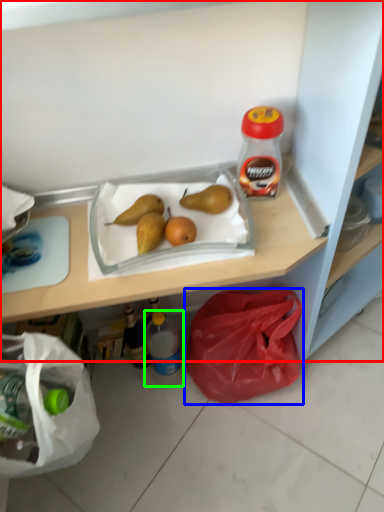
Question: Based on their relative distances, which object is nearer to shelf (highlighted by a red box)? Choose from plastic bag (highlighted by a blue box) and bottle (highlighted by a green box).

Choices:
 (A) plastic bag
 (B) bottle

Answer: (A)